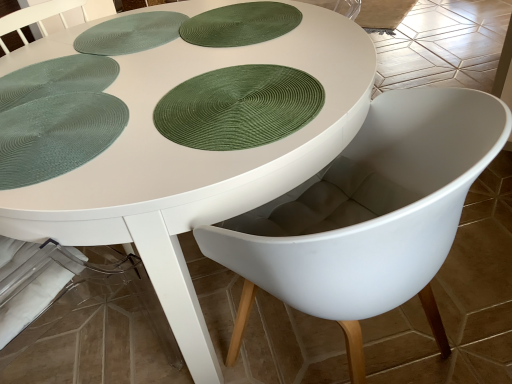
Locate an element on the screen. The height and width of the screenshot is (384, 512). free region under green textured placemat at left, marked as the first paper plate in a bottom-to-top arrangement (from a real-world perspective) is located at coordinates (63, 130).